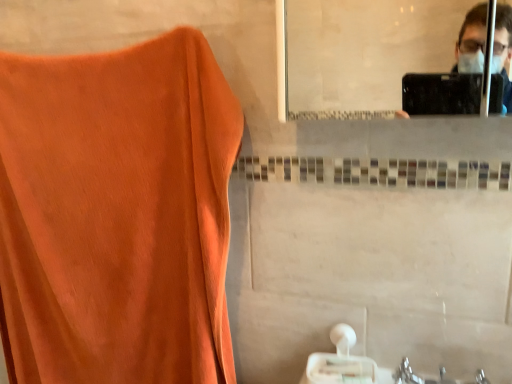
Question: Is white matte tissue at lower center completely or partially inside orange fabric at left?

Choices:
 (A) yes
 (B) no

Answer: (B)

Question: From the image's perspective, would you say orange fabric at left is shown under white matte tissue at lower center?

Choices:
 (A) yes
 (B) no

Answer: (B)

Question: Does orange fabric at left appear on the right side of white matte tissue at lower center?

Choices:
 (A) yes
 (B) no

Answer: (B)

Question: Could you tell me if orange fabric at left is turned towards white matte tissue at lower center?

Choices:
 (A) no
 (B) yes

Answer: (A)

Question: Does orange fabric at left come behind white matte tissue at lower center?

Choices:
 (A) no
 (B) yes

Answer: (A)

Question: Is orange fabric at left thinner than white matte tissue at lower center?

Choices:
 (A) no
 (B) yes

Answer: (B)

Question: Is white matte tissue at lower center facing towards orange fabric at left?

Choices:
 (A) yes
 (B) no

Answer: (B)

Question: From the image's perspective, is white matte tissue at lower center under orange fabric at left?

Choices:
 (A) yes
 (B) no

Answer: (A)

Question: From a real-world perspective, is white matte tissue at lower center under orange fabric at left?

Choices:
 (A) no
 (B) yes

Answer: (B)

Question: Is white matte tissue at lower center further to the viewer compared to orange fabric at left?

Choices:
 (A) no
 (B) yes

Answer: (B)

Question: Is white matte tissue at lower center next to orange fabric at left and touching it?

Choices:
 (A) no
 (B) yes

Answer: (A)

Question: From the image's perspective, would you say white matte tissue at lower center is positioned over orange fabric at left?

Choices:
 (A) yes
 (B) no

Answer: (B)

Question: Considering the positions of orange fabric at left and white matte tissue at lower center in the image, is orange fabric at left wider or thinner than white matte tissue at lower center?

Choices:
 (A) wide
 (B) thin

Answer: (B)